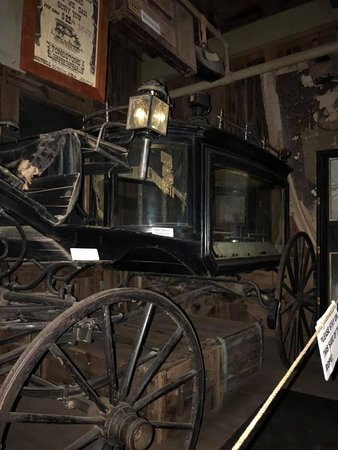
The height and width of the screenshot is (450, 338). Identify the location of ceiling. (234, 11).